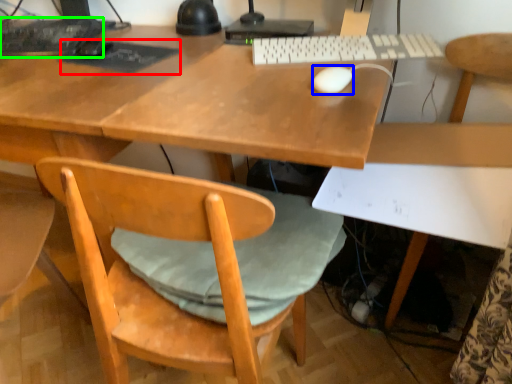
Question: Based on their relative distances, which object is farther from mousepad (highlighted by a red box)? Choose from mouse (highlighted by a blue box) and computer keyboard (highlighted by a green box).

Choices:
 (A) mouse
 (B) computer keyboard

Answer: (A)